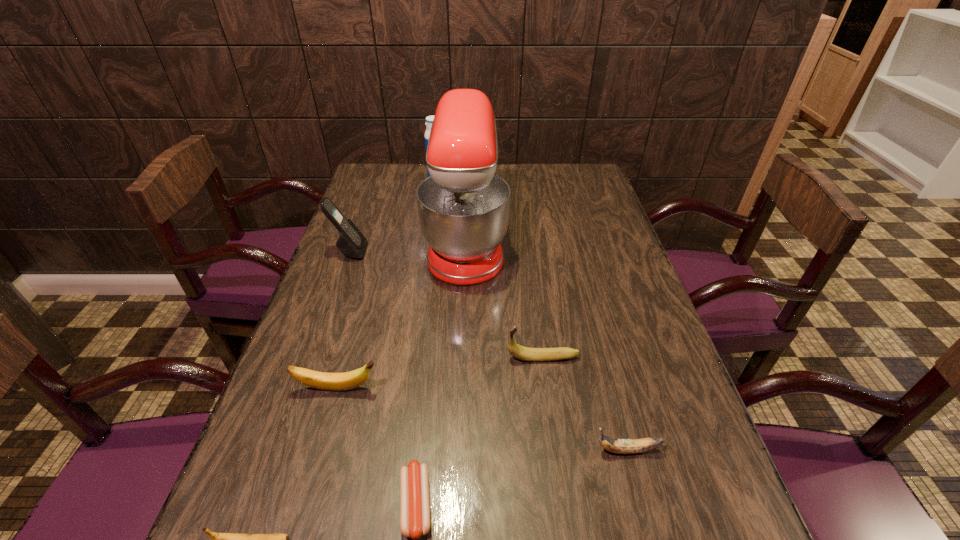
This screenshot has width=960, height=540. Identify the location of object present at the right edge. (619, 446).

Where is `vacant space at the left edge`? This screenshot has width=960, height=540. vacant space at the left edge is located at coordinates (331, 276).

The width and height of the screenshot is (960, 540). In order to click on vacant region at the right edge of the desktop in this screenshot , I will do `click(710, 534)`.

Find the location of a particular element. The image size is (960, 540). free region at the far right corner of the desktop is located at coordinates point(582,182).

Where is `vacant region between the third nearest banana and the fourth farthest object`? The image size is (960, 540). vacant region between the third nearest banana and the fourth farthest object is located at coordinates (441, 373).

This screenshot has height=540, width=960. Identify the location of vacant space that's between the tallest object and the third farthest banana. (546, 347).

Locate an element on the screen. The width and height of the screenshot is (960, 540). vacant point located between the third nearest banana and the farthest object is located at coordinates (387, 284).

Where is `the closest object to the sixth farthest object`? The height and width of the screenshot is (540, 960). the closest object to the sixth farthest object is located at coordinates (520, 352).

Locate which object is the closest to the fifth farthest object. Please provide its 2D coordinates. Your answer should be formatted as a tuple, i.e. [(x, y)], where the tuple contains the x and y coordinates of a point satisfying the conditions above.

[(414, 483)]

Point out which banana is positioned as the second nearest to the sixth shortest object. Please provide its 2D coordinates. Your answer should be formatted as a tuple, i.e. [(x, y)], where the tuple contains the x and y coordinates of a point satisfying the conditions above.

[(520, 352)]